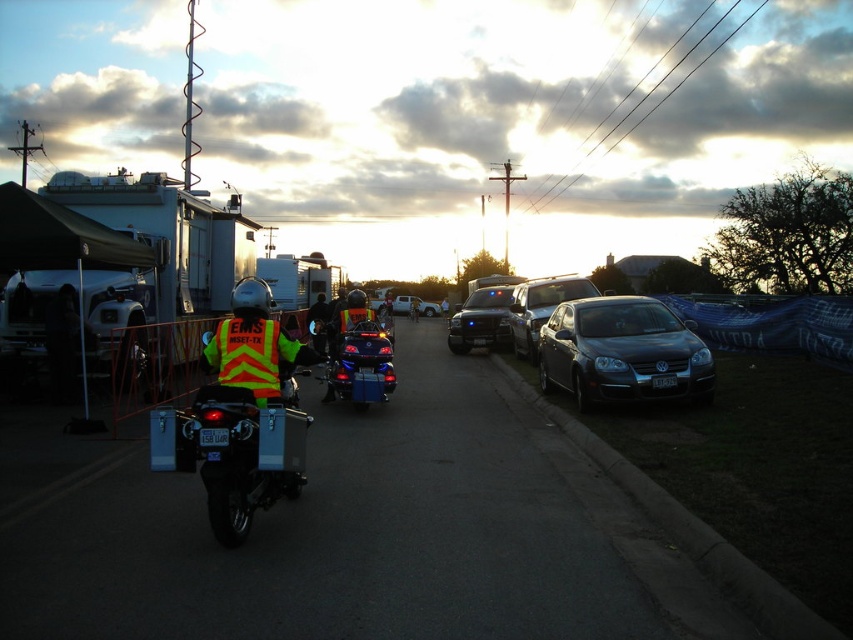
You are a pedestrian standing on the sidewalk and see both the reflective yellow safety vest at center and the metallic blue truck at center. Which object is closer to you?

The reflective yellow safety vest at center is closer to you because it is in front of the metallic blue truck at center.

You are a pedestrian standing on the sidewalk observing the matte black sedan at center and the shiny blue motorcycle at center. Which vehicle has a greater width?

The matte black sedan at center has a greater width than the shiny blue motorcycle at center, as stated in the description.